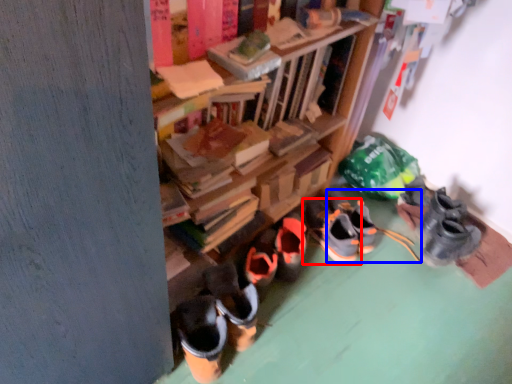
Question: Which point is closer to the camera, footwear (highlighted by a red box) or footwear (highlighted by a blue box)?

Choices:
 (A) footwear
 (B) footwear

Answer: (A)